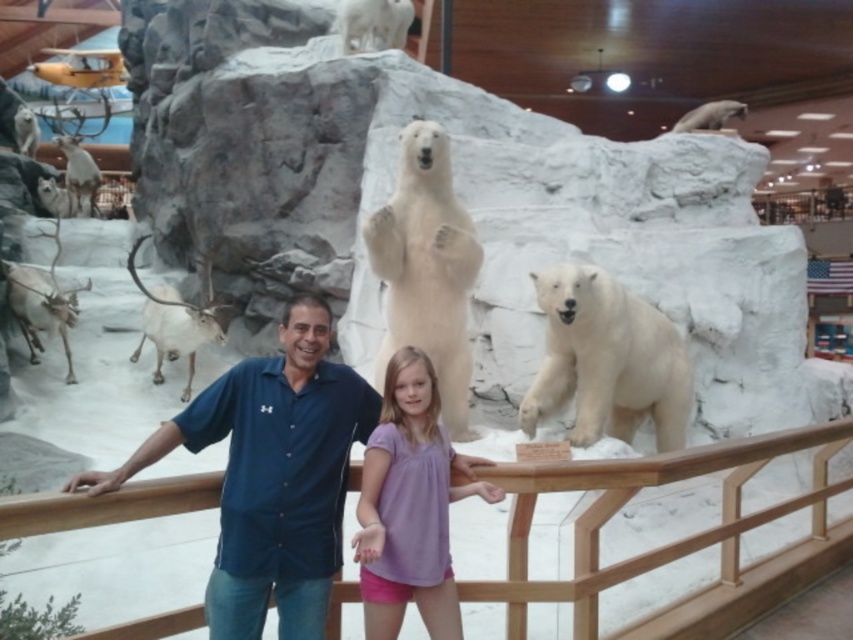
Question: Which object appears closest to the camera in this image?

Choices:
 (A) white fur polar bear at right
 (B) blue cotton shirt at center
 (C) purple cotton shirt at center
 (D) white fur polar bear at center

Answer: (B)

Question: Estimate the real-world distances between objects in this image. Which object is closer to the blue cotton shirt at center?

Choices:
 (A) wooden at center
 (B) white fur polar bear at center
 (C) purple cotton shirt at center
 (D) white fur polar bear at right

Answer: (C)

Question: Is wooden at center below white fur polar bear at center?

Choices:
 (A) no
 (B) yes

Answer: (B)

Question: Can you confirm if wooden at center is positioned to the right of white fur polar bear at right?

Choices:
 (A) yes
 (B) no

Answer: (B)

Question: Which of the following is the farthest from the observer?

Choices:
 (A) (585, 324)
 (B) (422, 493)
 (C) (700, 538)

Answer: (A)

Question: Can you confirm if purple cotton shirt at center is positioned to the right of white fur polar bear at center?

Choices:
 (A) yes
 (B) no

Answer: (A)